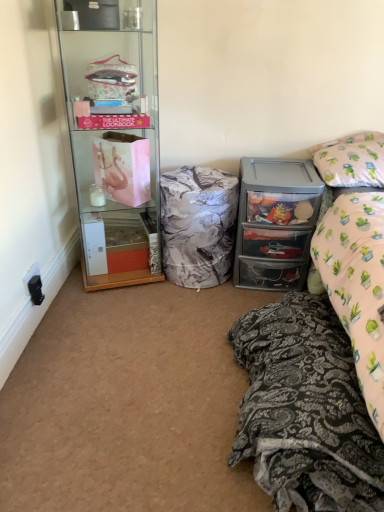
Identify the location of unoccupied area in front of marble-patterned fabric at center. (182, 307).